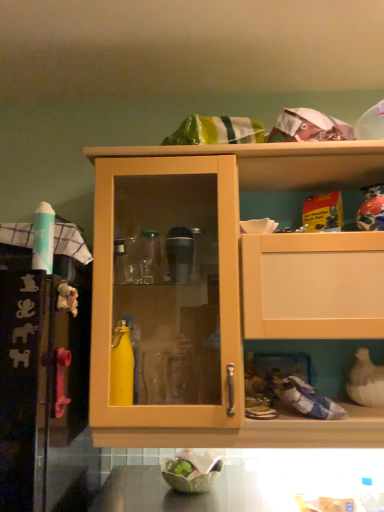
In order to face matte wood cabinet at center, should I rotate leftwards or rightwards?

Turn right by 8.260 degrees to look at matte wood cabinet at center.

Find the location of `smooth dark brown countertop at lower center`. smooth dark brown countertop at lower center is located at coordinates (240, 486).

Where is `green leafy material bowl at lower center`? The height and width of the screenshot is (512, 384). green leafy material bowl at lower center is located at coordinates (192, 470).

Locate an element on the screen. matte wood cabinet at center is located at coordinates (220, 288).

What's the angular difference between smooth dark brown countertop at lower center and matte wood cabinet at center's facing directions?

The angular difference between smooth dark brown countertop at lower center and matte wood cabinet at center is 0.992 degrees.

Are smooth dark brown countertop at lower center and matte wood cabinet at center beside each other?

There is a gap between smooth dark brown countertop at lower center and matte wood cabinet at center.

From the image's perspective, does smooth dark brown countertop at lower center appear lower than matte wood cabinet at center?

Correct, smooth dark brown countertop at lower center appears lower than matte wood cabinet at center in the image.

Considering the positions of objects smooth dark brown countertop at lower center and matte wood cabinet at center in the image provided, who is more to the right, smooth dark brown countertop at lower center or matte wood cabinet at center?

Positioned to the right is matte wood cabinet at center.

How many degrees apart are the facing directions of matte wood cabinet at center and smooth dark brown countertop at lower center?

0.992 degrees.

Considering the positions of point (281, 162) and point (198, 499), is point (281, 162) closer or farther from the camera than point (198, 499)?

Point (281, 162) is positioned farther from the camera compared to point (198, 499).

Can you confirm if matte wood cabinet at center is positioned to the right of smooth dark brown countertop at lower center?

Yes.

Is matte wood cabinet at center aimed at smooth dark brown countertop at lower center?

No.

Considering the positions of objects green leafy material bowl at lower center and matte wood cabinet at center in the image provided, who is in front, green leafy material bowl at lower center or matte wood cabinet at center?

matte wood cabinet at center is in front.

Is green leafy material bowl at lower center to the left or to the right of matte wood cabinet at center in the image?

In the image, green leafy material bowl at lower center appears on the left side of matte wood cabinet at center.

Find the location of `bowl below the matte wood cabinet at center (from the image's perspective)`. bowl below the matte wood cabinet at center (from the image's perspective) is located at coordinates (192, 470).

Could you tell me if green leafy material bowl at lower center is turned towards matte wood cabinet at center?

No, green leafy material bowl at lower center is not turned towards matte wood cabinet at center.

Between green leafy material bowl at lower center and smooth dark brown countertop at lower center, which one is positioned in front?

smooth dark brown countertop at lower center is more forward.

How far apart are green leafy material bowl at lower center and smooth dark brown countertop at lower center?

5.74 inches.

Is green leafy material bowl at lower center outside of smooth dark brown countertop at lower center?

green leafy material bowl at lower center is positioned outside smooth dark brown countertop at lower center.

In the image, is green leafy material bowl at lower center on the left side or the right side of smooth dark brown countertop at lower center?

Clearly, green leafy material bowl at lower center is on the left of smooth dark brown countertop at lower center in the image.

In the scene shown: Is smooth dark brown countertop at lower center oriented towards green leafy material bowl at lower center?

No, smooth dark brown countertop at lower center is not facing towards green leafy material bowl at lower center.

Is smooth dark brown countertop at lower center taller than green leafy material bowl at lower center?

Indeed, smooth dark brown countertop at lower center has a greater height compared to green leafy material bowl at lower center.

Choose the correct answer: Is smooth dark brown countertop at lower center inside green leafy material bowl at lower center or outside it?

smooth dark brown countertop at lower center is not enclosed by green leafy material bowl at lower center.

In terms of height, does matte wood cabinet at center look taller or shorter compared to green leafy material bowl at lower center?

Clearly, matte wood cabinet at center is taller compared to green leafy material bowl at lower center.

Considering their positions, is matte wood cabinet at center located in front of or behind green leafy material bowl at lower center?

Clearly, matte wood cabinet at center is in front of green leafy material bowl at lower center.

Could you tell me if matte wood cabinet at center is turned towards green leafy material bowl at lower center?

No, matte wood cabinet at center is not aimed at green leafy material bowl at lower center.

Who is smaller, matte wood cabinet at center or green leafy material bowl at lower center?

With smaller size is green leafy material bowl at lower center.

Where is `cabinetry above the smooth dark brown countertop at lower center (from the image's perspective)`? This screenshot has width=384, height=512. cabinetry above the smooth dark brown countertop at lower center (from the image's perspective) is located at coordinates (220, 288).

Locate an element on the screen. The height and width of the screenshot is (512, 384). counter top below the matte wood cabinet at center (from the image's perspective) is located at coordinates (240, 486).

Based on their spatial positions, is smooth dark brown countertop at lower center or green leafy material bowl at lower center closer to matte wood cabinet at center?

The object closer to matte wood cabinet at center is smooth dark brown countertop at lower center.

Considering their positions, is matte wood cabinet at center positioned further to smooth dark brown countertop at lower center than green leafy material bowl at lower center?

matte wood cabinet at center is further to smooth dark brown countertop at lower center.

Considering their positions, is smooth dark brown countertop at lower center positioned further to green leafy material bowl at lower center than matte wood cabinet at center?

matte wood cabinet at center.

Estimate the real-world distances between objects in this image. Which object is closer to green leafy material bowl at lower center, matte wood cabinet at center or smooth dark brown countertop at lower center?

The object closer to green leafy material bowl at lower center is smooth dark brown countertop at lower center.

Which object lies further to the anchor point matte wood cabinet at center, green leafy material bowl at lower center or smooth dark brown countertop at lower center?

green leafy material bowl at lower center.

Which object lies nearer to the anchor point smooth dark brown countertop at lower center, green leafy material bowl at lower center or matte wood cabinet at center?

green leafy material bowl at lower center is positioned closer to the anchor smooth dark brown countertop at lower center.

You are a GUI agent. You are given a task and a screenshot of the screen. Output one action in this format:
    pyautogui.click(x=<x>, y=<y>)
    Task: Click on the bowl between matte wood cabinet at center and smooth dark brown countertop at lower center in the up-down direction
    The width and height of the screenshot is (384, 512).
    Given the screenshot: What is the action you would take?
    pyautogui.click(x=192, y=470)